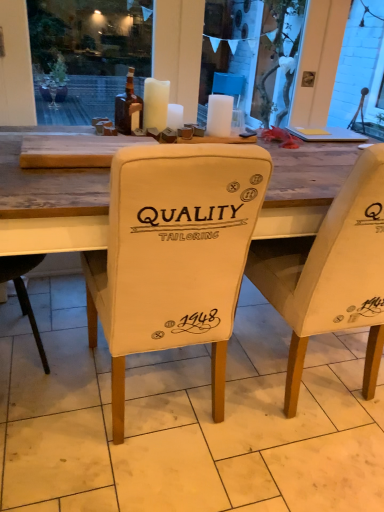
You are a GUI agent. You are given a task and a screenshot of the screen. Output one action in this format:
    pyautogui.click(x=<x>, y=<y>)
    Task: Click on the vacant region to the left of beige fabric chair at center, which is counted as the second chair, starting from the right
    This screenshot has height=512, width=384.
    Given the screenshot: What is the action you would take?
    pyautogui.click(x=55, y=375)